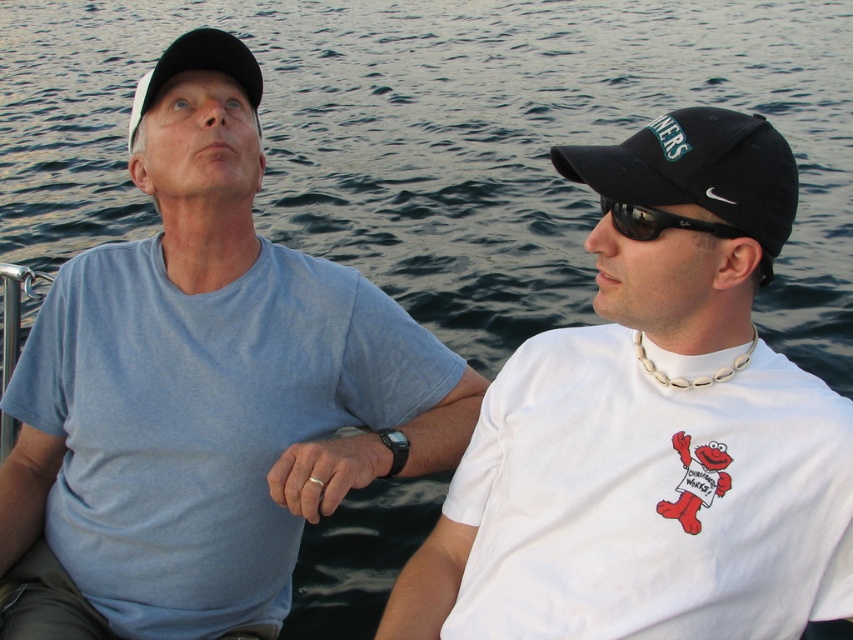
Who is more forward, (247, 230) or (776, 545)?

Positioned in front is point (776, 545).

Is point (193, 161) farther from camera compared to point (646, 401)?

That is True.

Who is more forward, (x=167, y=118) or (x=764, y=609)?

Point (x=764, y=609) is in front.

You are a GUI agent. You are given a task and a screenshot of the screen. Output one action in this format:
    pyautogui.click(x=<x>, y=<y>)
    Task: Click on the matte blue t-shirt at left
    The image size is (853, 640).
    Given the screenshot: What is the action you would take?
    pyautogui.click(x=202, y=392)

What do you see at coordinates (444, 141) in the screenshot? This screenshot has width=853, height=640. I see `dark blue water at center` at bounding box center [444, 141].

At what (x,y) coordinates should I click in order to perform the action: click on dark blue water at center. Please return your answer as a coordinate pair (x, y). Image resolution: width=853 pixels, height=640 pixels. Looking at the image, I should click on (444, 141).

Image resolution: width=853 pixels, height=640 pixels. I want to click on dark blue water at center, so click(444, 141).

Does dark blue water at center have a greater width compared to white matte baseball cap at upper left?

Yes.

Where is `dark blue water at center`? This screenshot has height=640, width=853. dark blue water at center is located at coordinates (444, 141).

Is point (570, 120) farther from camera compared to point (196, 42)?

That is True.

Where is `dark blue water at center`? dark blue water at center is located at coordinates (444, 141).